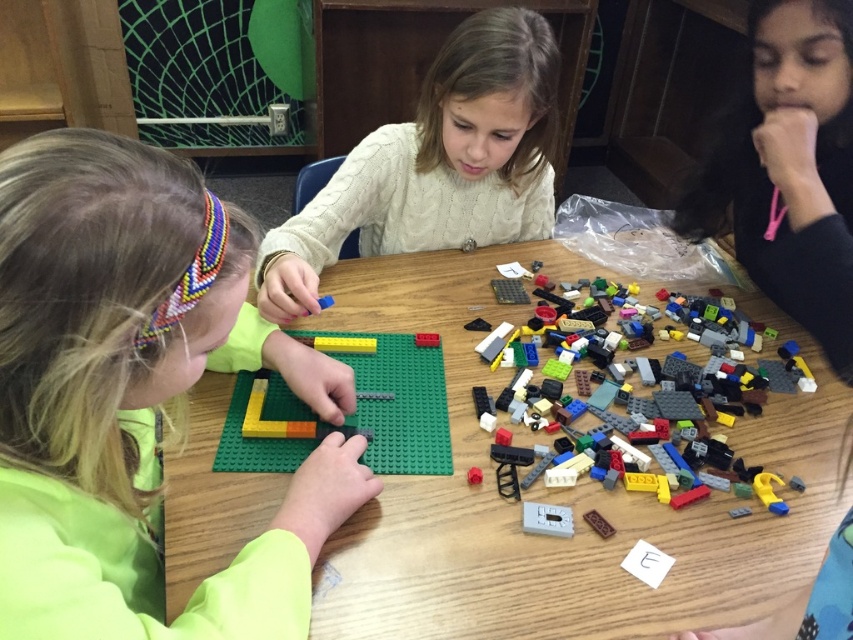
Question: Which point is farther from the camera taking this photo?

Choices:
 (A) (819, 81)
 (B) (146, 275)

Answer: (A)

Question: Is neon green shirt at upper left further to the viewer compared to wooden table at center?

Choices:
 (A) yes
 (B) no

Answer: (B)

Question: Is the position of wooden table at center less distant than that of white cable-knit sweater at center?

Choices:
 (A) no
 (B) yes

Answer: (B)

Question: Observing the image, what is the correct spatial positioning of neon green shirt at upper left in reference to multicolored plastic lego pieces at center?

Choices:
 (A) right
 (B) left

Answer: (B)

Question: Among these points, which one is farthest from the camera?

Choices:
 (A) (722, 339)
 (B) (206, 620)
 (C) (824, 272)
 (D) (479, 180)

Answer: (D)

Question: Which of these objects is positioned closest to the wooden table at center?

Choices:
 (A) white cable-knit sweater at center
 (B) multicolored plastic lego pieces at center
 (C) matte black hair at upper right
 (D) neon green shirt at upper left

Answer: (B)